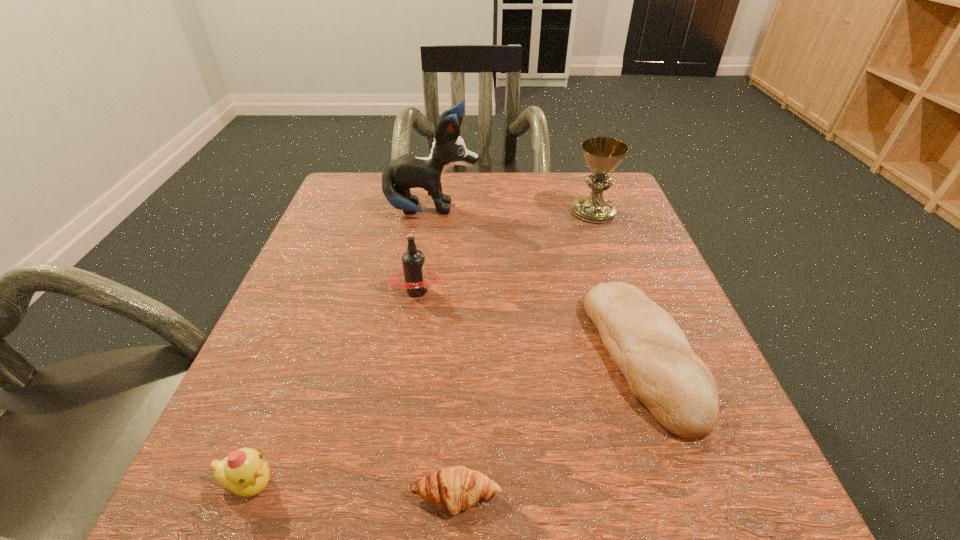
The height and width of the screenshot is (540, 960). Find the location of `blank space located on the front-facing side of the third shortest object`. blank space located on the front-facing side of the third shortest object is located at coordinates (570, 484).

Find the location of a particular element. vacant area located on the back of the fifth tallest object is located at coordinates (585, 190).

The width and height of the screenshot is (960, 540). In order to click on puppy located in the far edge section of the desktop in this screenshot , I will do `click(408, 171)`.

Where is `chalice at the far edge`? The image size is (960, 540). chalice at the far edge is located at coordinates (602, 154).

The height and width of the screenshot is (540, 960). What are the coordinates of `duckling that is at the near edge` in the screenshot? It's located at (244, 472).

Find the location of a particular element. pastry present at the near edge is located at coordinates coord(455,488).

This screenshot has width=960, height=540. I want to click on puppy that is at the left edge, so click(408, 171).

You are a GUI agent. You are given a task and a screenshot of the screen. Output one action in this format:
    pyautogui.click(x=<x>, y=<y>)
    Task: Click on the duckling at the left edge
    The image size is (960, 540).
    Given the screenshot: What is the action you would take?
    [x=244, y=472]

In order to click on chalice present at the right edge in this screenshot , I will do point(602,154).

The image size is (960, 540). In order to click on bread located at the right edge in this screenshot , I will do `click(652, 352)`.